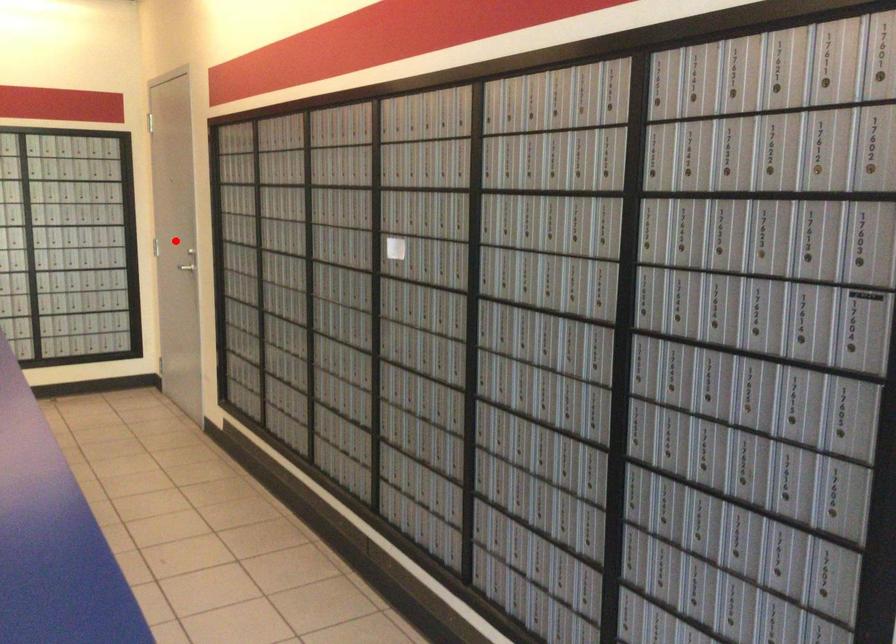
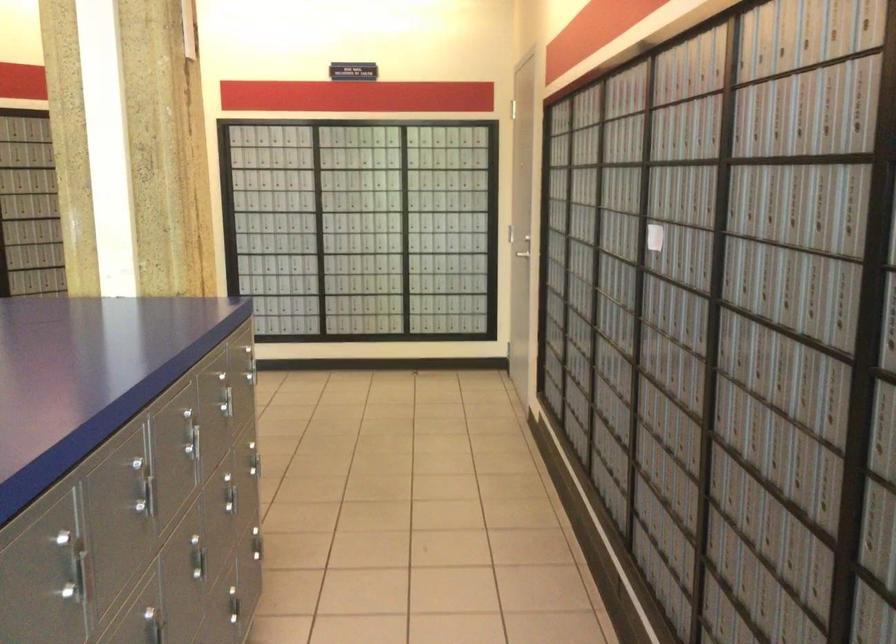
Question: I am providing you with two images of the same scene from different viewpoints. A red point is marked on the first image. At the location where the point appears in image 1, is it still visible in image 2?

Choices:
 (A) Yes
 (B) No

Answer: (B)